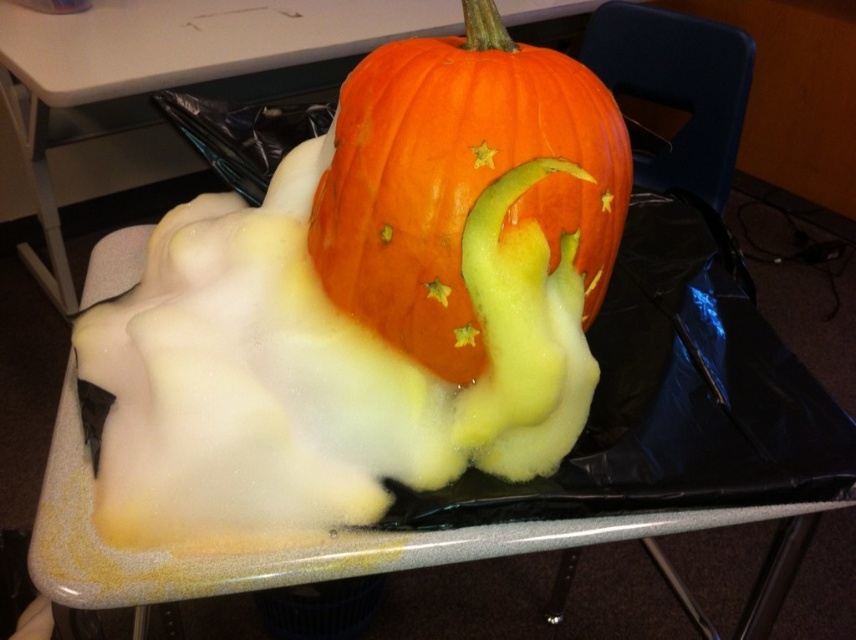
Who is more forward, (468, 330) or (218, 38)?

Point (468, 330) is more forward.

The width and height of the screenshot is (856, 640). What do you see at coordinates (461, 180) in the screenshot?
I see `orange matte pumpkin at center` at bounding box center [461, 180].

Identify the location of orange matte pumpkin at center. Image resolution: width=856 pixels, height=640 pixels. (461, 180).